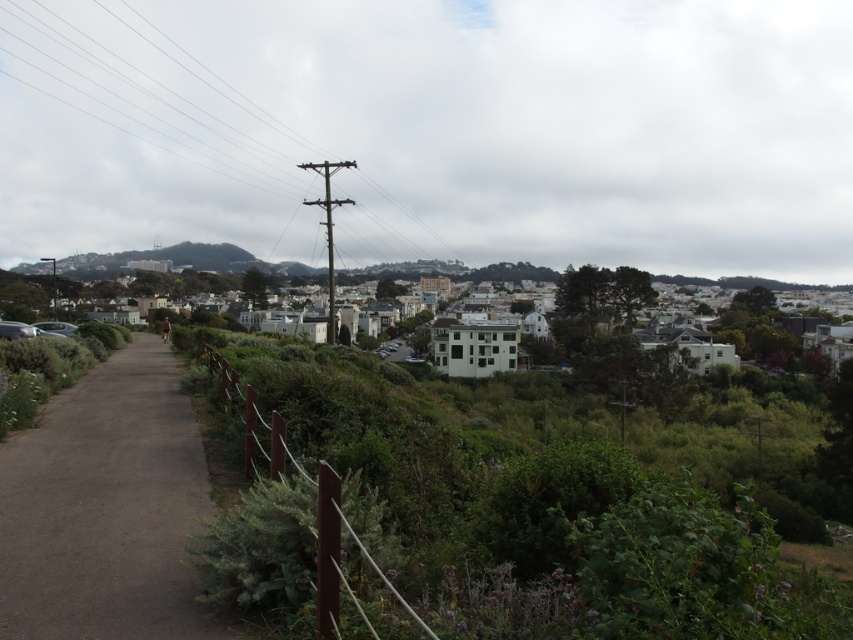
Question: Which of the following is the farthest from the observer?

Choices:
 (A) white matte building at center
 (B) wooden pole at upper center
 (C) dirt path at center

Answer: (A)

Question: Can you confirm if dirt path at center is wider than white matte building at center?

Choices:
 (A) no
 (B) yes

Answer: (A)

Question: Can you confirm if wooden pole at upper center is positioned to the right of dirt path at center?

Choices:
 (A) yes
 (B) no

Answer: (B)

Question: Is wooden pole at upper center above white matte building at center?

Choices:
 (A) no
 (B) yes

Answer: (B)

Question: Estimate the real-world distances between objects in this image. Which object is farther from the white matte building at center?

Choices:
 (A) wooden pole at upper center
 (B) dirt path at center

Answer: (B)

Question: Which point appears farthest from the camera in this image?

Choices:
 (A) (252, 129)
 (B) (641, 305)

Answer: (A)